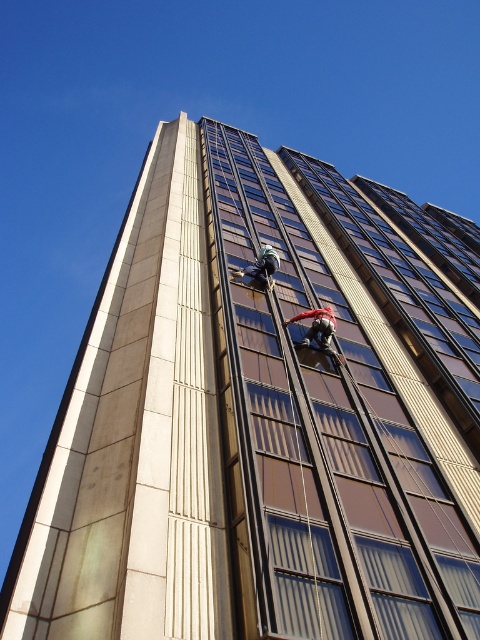
Can you confirm if red helmeted worker at center is wider than metallic helmet at center?

In fact, red helmeted worker at center might be narrower than metallic helmet at center.

Looking at this image, which of these two, red helmeted worker at center or metallic helmet at center, stands shorter?

red helmeted worker at center

What do you see at coordinates (317, 326) in the screenshot? I see `red helmeted worker at center` at bounding box center [317, 326].

Where is `red helmeted worker at center`? red helmeted worker at center is located at coordinates (317, 326).